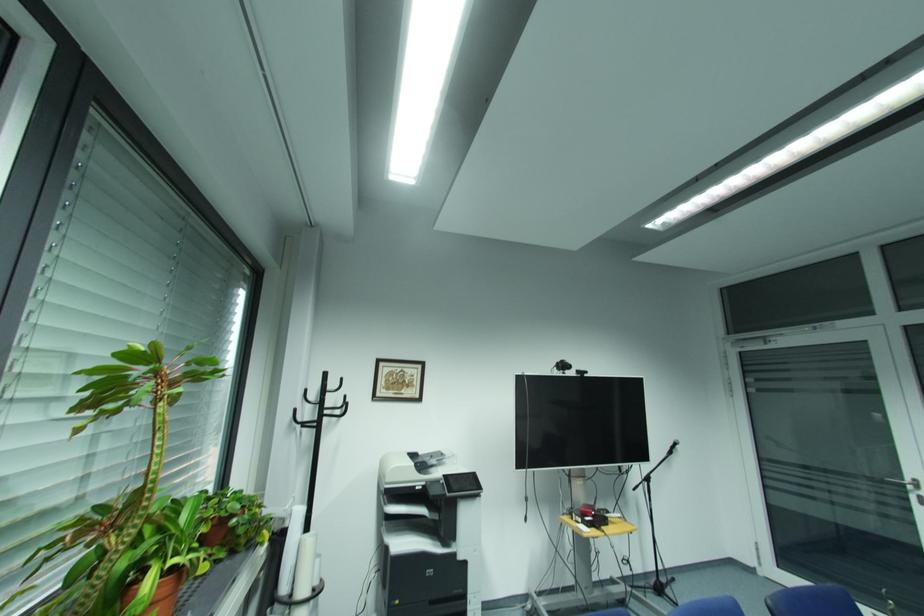
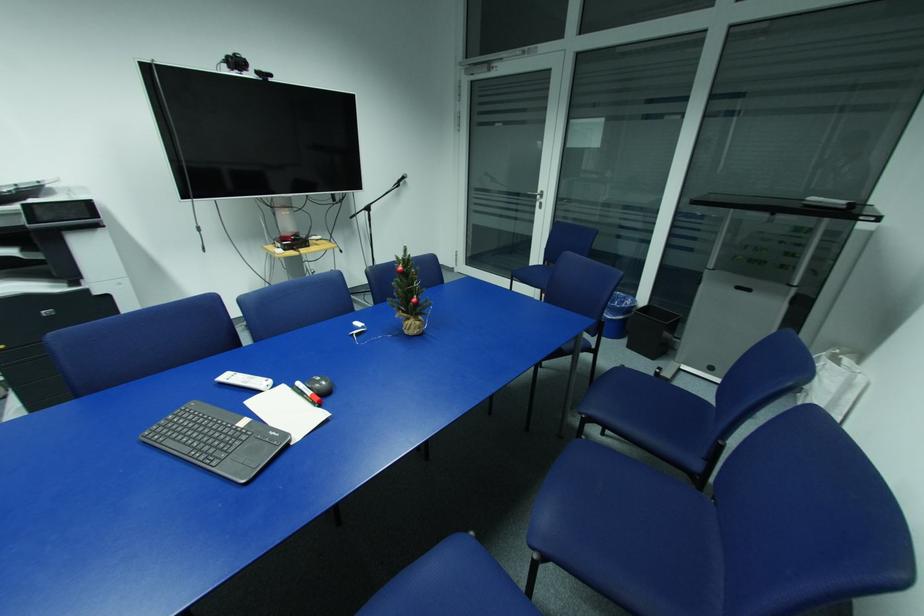
The first image is from the beginning of the video and the second image is from the end. How did the camera likely rotate when shooting the video?

The rotation direction of the camera is right-down.